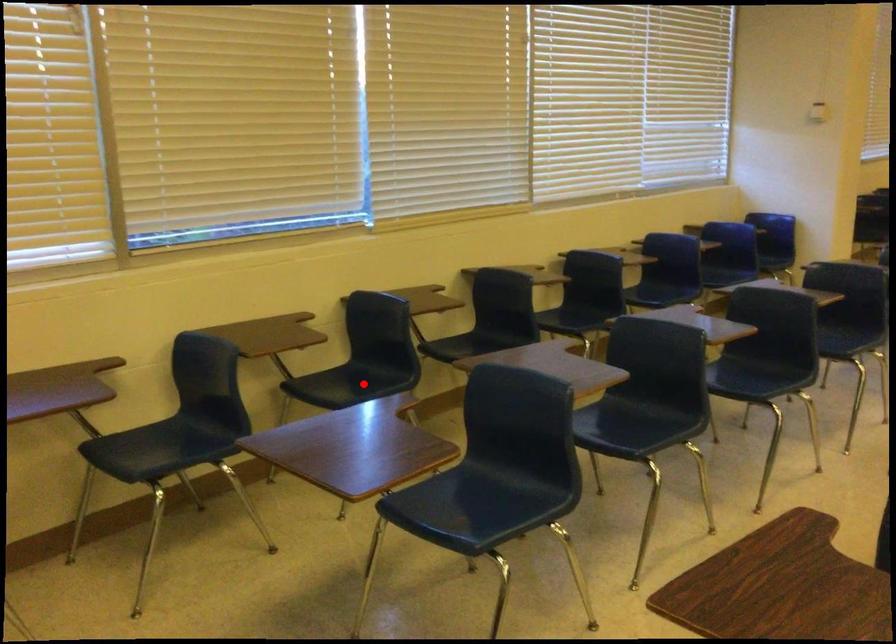
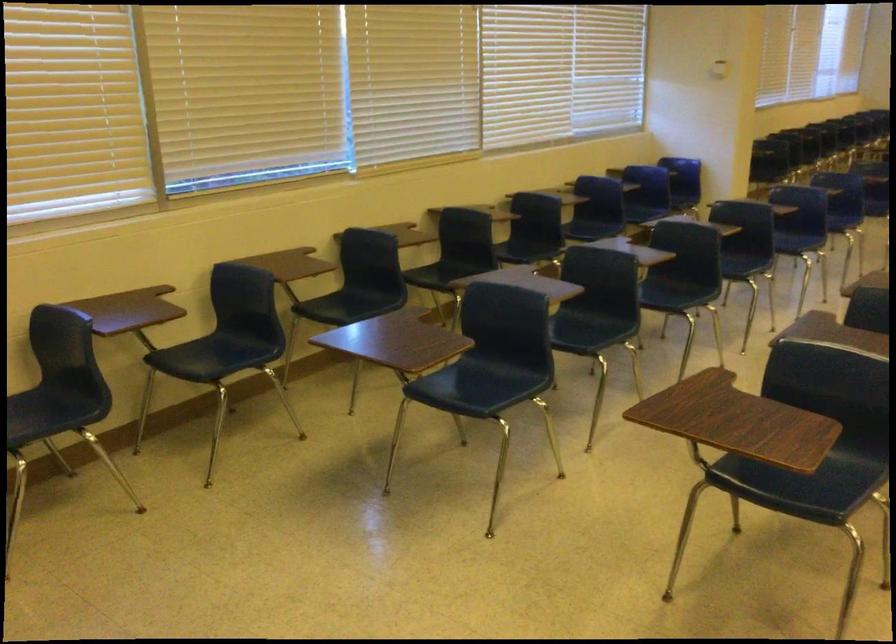
Question: I am providing you with two images of the same scene from different viewpoints. Given a red point in image1, look at the same physical point in image2. Is it:

Choices:
 (A) Closer to the viewpoint
 (B) Farther from the viewpoint

Answer: (B)